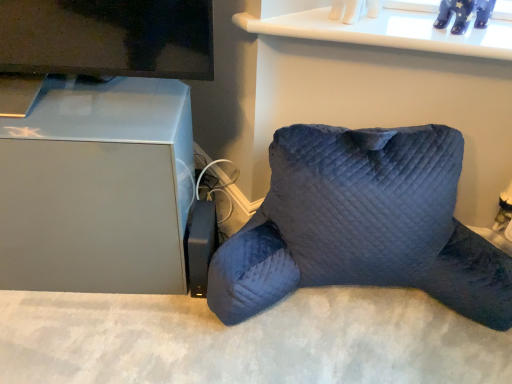
Question: Choose the correct answer: Is velvet blue pillow at lower right inside matte gray cabinet at left or outside it?

Choices:
 (A) outside
 (B) inside

Answer: (A)

Question: From the image's perspective, is velvet blue pillow at lower right positioned above or below matte gray cabinet at left?

Choices:
 (A) above
 (B) below

Answer: (B)

Question: Considering the positions of velvet blue pillow at lower right and matte gray cabinet at left in the image, is velvet blue pillow at lower right wider or thinner than matte gray cabinet at left?

Choices:
 (A) thin
 (B) wide

Answer: (B)

Question: In terms of size, does matte gray cabinet at left appear bigger or smaller than velvet blue pillow at lower right?

Choices:
 (A) big
 (B) small

Answer: (B)

Question: Based on their positions, is matte gray cabinet at left located to the left or right of velvet blue pillow at lower right?

Choices:
 (A) left
 (B) right

Answer: (A)

Question: Would you say matte gray cabinet at left is inside or outside velvet blue pillow at lower right?

Choices:
 (A) inside
 (B) outside

Answer: (B)

Question: From a real-world perspective, relative to velvet blue pillow at lower right, is matte gray cabinet at left vertically above or below?

Choices:
 (A) above
 (B) below

Answer: (A)